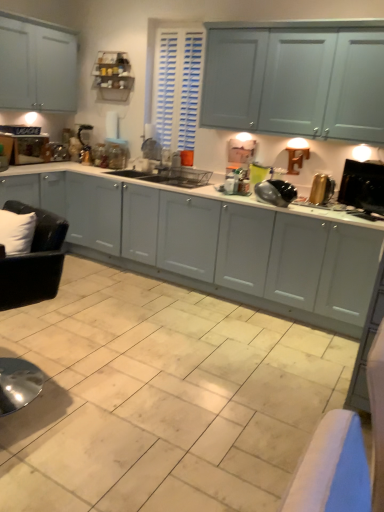
The height and width of the screenshot is (512, 384). Find the location of `beige ceramic tile at center`. beige ceramic tile at center is located at coordinates (161, 398).

Where is `gold metallic toaster at right, acting as the second appliance starting from the left`? The image size is (384, 512). gold metallic toaster at right, acting as the second appliance starting from the left is located at coordinates (321, 189).

From the picture: Measure the distance between gold metallic toaster at right, the second appliance when ordered from right to left, and camera.

The depth of gold metallic toaster at right, the second appliance when ordered from right to left, is 3.18 meters.

What do you see at coordinates (276, 192) in the screenshot? I see `black glossy pan at center, which is counted as the 1th appliance, starting from the left` at bounding box center [276, 192].

What do you see at coordinates (363, 186) in the screenshot? This screenshot has width=384, height=512. I see `black plastic monitor at right, which is counted as the first appliance, starting from the right` at bounding box center [363, 186].

Where is `beige ceramic tile at center`? The height and width of the screenshot is (512, 384). beige ceramic tile at center is located at coordinates (161, 398).

Are matte white cabinets at center and black glossy pan at center, which is counted as the 1th appliance, starting from the left, far apart?

No.

Is matte white cabinets at center closer to camera compared to black glossy pan at center, which is counted as the 1th appliance, starting from the left?

Yes, matte white cabinets at center is closer to the camera.

From a real-world perspective, which object rests below the other?

In real-world perspective, matte white cabinets at center is lower.

Is black plastic monitor at right, which is counted as the first appliance, starting from the right, with matte white cabinets at center?

No.

How different are the orientations of black plastic monitor at right, positioned as the third appliance in left-to-right order, and matte white cabinets at center in degrees?

33.6 degrees.

What are the coordinates of `cabinetry on the left of black plastic monitor at right, positioned as the third appliance in left-to-right order` in the screenshot? It's located at (213, 242).

Is black plastic monitor at right, which is counted as the first appliance, starting from the right, surrounding matte white cabinets at center?

Actually, matte white cabinets at center is outside black plastic monitor at right, which is counted as the first appliance, starting from the right.

From the image's perspective, between gold metallic toaster at right, the second appliance when ordered from right to left, and black glossy pan at center, which is counted as the 1th appliance, starting from the left, which one is located above?

From the image's view, gold metallic toaster at right, the second appliance when ordered from right to left, is above.

Is gold metallic toaster at right, the second appliance when ordered from right to left, bigger than black glossy pan at center, which ranks as the third appliance in right-to-left order?

No.

Image resolution: width=384 pixels, height=512 pixels. Identify the location of the 1st appliance in front of the gold metallic toaster at right, the second appliance when ordered from right to left. (276, 192).

Looking at this image, would you consider black glossy pan at center, which is counted as the 1th appliance, starting from the left, to be distant from black plastic monitor at right, positioned as the third appliance in left-to-right order?

That's not correct — black glossy pan at center, which is counted as the 1th appliance, starting from the left, is a little close to black plastic monitor at right, positioned as the third appliance in left-to-right order.

Does point (287, 203) appear closer or farther from the camera than point (366, 170)?

Point (287, 203).

What's the angular difference between black glossy pan at center, which ranks as the third appliance in right-to-left order, and black plastic monitor at right, which is counted as the first appliance, starting from the right,'s facing directions?

black glossy pan at center, which ranks as the third appliance in right-to-left order, and black plastic monitor at right, which is counted as the first appliance, starting from the right, are facing 34.9 degrees away from each other.

In the image, is black glossy pan at center, which ranks as the third appliance in right-to-left order, on the left side or the right side of black plastic monitor at right, positioned as the third appliance in left-to-right order?

From the image, it's evident that black glossy pan at center, which ranks as the third appliance in right-to-left order, is to the left of black plastic monitor at right, positioned as the third appliance in left-to-right order.

The image size is (384, 512). What are the coordinates of `ceramic tile below the black glossy pan at center, which is counted as the 1th appliance, starting from the left (from the image's perspective)` in the screenshot? It's located at (161, 398).

Is black glossy pan at center, which is counted as the 1th appliance, starting from the left, completely or partially outside of beige ceramic tile at center?

Yes, black glossy pan at center, which is counted as the 1th appliance, starting from the left, is not within beige ceramic tile at center.

Is black glossy pan at center, which ranks as the third appliance in right-to-left order, positioned far away from beige ceramic tile at center?

Yes, black glossy pan at center, which ranks as the third appliance in right-to-left order, and beige ceramic tile at center are quite far apart.

Looking at this image, between black glossy pan at center, which ranks as the third appliance in right-to-left order, and beige ceramic tile at center, which one is positioned behind?

black glossy pan at center, which ranks as the third appliance in right-to-left order, is further from the camera.

From the image's perspective, is black plastic monitor at right, positioned as the third appliance in left-to-right order, above gold metallic toaster at right, acting as the second appliance starting from the left?

Actually, black plastic monitor at right, positioned as the third appliance in left-to-right order, appears below gold metallic toaster at right, acting as the second appliance starting from the left, in the image.

Considering the relative positions of black plastic monitor at right, which is counted as the first appliance, starting from the right, and gold metallic toaster at right, the second appliance when ordered from right to left, in the image provided, is black plastic monitor at right, which is counted as the first appliance, starting from the right, to the left or to the right of gold metallic toaster at right, the second appliance when ordered from right to left,?

In the image, black plastic monitor at right, which is counted as the first appliance, starting from the right, appears on the right side of gold metallic toaster at right, the second appliance when ordered from right to left.

Considering the relative sizes of black plastic monitor at right, which is counted as the first appliance, starting from the right, and gold metallic toaster at right, the second appliance when ordered from right to left, in the image provided, is black plastic monitor at right, which is counted as the first appliance, starting from the right, smaller than gold metallic toaster at right, the second appliance when ordered from right to left,?

Incorrect, black plastic monitor at right, which is counted as the first appliance, starting from the right, is not smaller in size than gold metallic toaster at right, the second appliance when ordered from right to left.

From a real-world perspective, is black glossy pan at center, which is counted as the 1th appliance, starting from the left, physically above matte white cabinets at center?

Yes, from a real-world perspective, black glossy pan at center, which is counted as the 1th appliance, starting from the left, is above matte white cabinets at center.

Considering the positions of objects black glossy pan at center, which ranks as the third appliance in right-to-left order, and matte white cabinets at center in the image provided, who is more to the right, black glossy pan at center, which ranks as the third appliance in right-to-left order, or matte white cabinets at center?

Positioned to the right is black glossy pan at center, which ranks as the third appliance in right-to-left order.

Consider the image. Can you confirm if black glossy pan at center, which is counted as the 1th appliance, starting from the left, is bigger than matte white cabinets at center?

No, black glossy pan at center, which is counted as the 1th appliance, starting from the left, is not bigger than matte white cabinets at center.

Is black glossy pan at center, which ranks as the third appliance in right-to-left order, closer to camera compared to matte white cabinets at center?

No, black glossy pan at center, which ranks as the third appliance in right-to-left order, is further to the viewer.

At what (x,y) coordinates should I click in order to perform the action: click on the 1st appliance counting from the right side of the matte white cabinets at center. Please return your answer as a coordinate pair (x, y). Looking at the image, I should click on (276, 192).

From a real-world perspective, count 3rd appliances upward from the matte white cabinets at center and point to it. Please provide its 2D coordinates.

[(363, 186)]

When comparing their distances from matte white cabinets at center, does black glossy pan at center, which is counted as the 1th appliance, starting from the left, or black plastic monitor at right, positioned as the third appliance in left-to-right order, seem closer?

Based on the image, black glossy pan at center, which is counted as the 1th appliance, starting from the left, appears to be nearer to matte white cabinets at center.

Which object lies nearer to the anchor point gold metallic toaster at right, acting as the second appliance starting from the left, beige ceramic tile at center or black glossy pan at center, which is counted as the 1th appliance, starting from the left?

The object closer to gold metallic toaster at right, acting as the second appliance starting from the left, is black glossy pan at center, which is counted as the 1th appliance, starting from the left.

Considering their positions, is matte white cabinets at center positioned further to black plastic monitor at right, which is counted as the first appliance, starting from the right, than beige ceramic tile at center?

Among the two, beige ceramic tile at center is located further to black plastic monitor at right, which is counted as the first appliance, starting from the right.

From the image, which object appears to be nearer to matte white cabinets at center, beige ceramic tile at center or gold metallic toaster at right, the second appliance when ordered from right to left?

beige ceramic tile at center is closer to matte white cabinets at center.

From the image, which object appears to be nearer to black plastic monitor at right, which is counted as the first appliance, starting from the right, black glossy pan at center, which is counted as the 1th appliance, starting from the left, or beige ceramic tile at center?

black glossy pan at center, which is counted as the 1th appliance, starting from the left.

Looking at the image, which one is located closer to matte white cabinets at center, black plastic monitor at right, positioned as the third appliance in left-to-right order, or beige ceramic tile at center?

Based on the image, beige ceramic tile at center appears to be nearer to matte white cabinets at center.

When comparing their distances from gold metallic toaster at right, the second appliance when ordered from right to left, does matte white cabinets at center or beige ceramic tile at center seem closer?

Among the two, matte white cabinets at center is located nearer to gold metallic toaster at right, the second appliance when ordered from right to left.

From the image, which object appears to be nearer to matte white cabinets at center, gold metallic toaster at right, acting as the second appliance starting from the left, or black glossy pan at center, which is counted as the 1th appliance, starting from the left?

black glossy pan at center, which is counted as the 1th appliance, starting from the left, is positioned closer to the anchor matte white cabinets at center.

You are a GUI agent. You are given a task and a screenshot of the screen. Output one action in this format:
    pyautogui.click(x=<x>, y=<y>)
    Task: Click on the cabinetry between beige ceramic tile at center and black plastic monitor at right, which is counted as the first appliance, starting from the right, in the horizontal direction
    
    Given the screenshot: What is the action you would take?
    (x=213, y=242)

What are the coordinates of `appliance between matte white cabinets at center and gold metallic toaster at right, the second appliance when ordered from right to left, in the horizontal direction` in the screenshot? It's located at [276, 192].

This screenshot has width=384, height=512. Find the location of `appliance located between beige ceramic tile at center and black glossy pan at center, which is counted as the 1th appliance, starting from the left, in the depth direction`. appliance located between beige ceramic tile at center and black glossy pan at center, which is counted as the 1th appliance, starting from the left, in the depth direction is located at coordinates (363, 186).

You are a GUI agent. You are given a task and a screenshot of the screen. Output one action in this format:
    pyautogui.click(x=<x>, y=<y>)
    Task: Click on the cabinetry between beige ceramic tile at center and gold metallic toaster at right, the second appliance when ordered from right to left, from front to back
    This screenshot has width=384, height=512.
    Given the screenshot: What is the action you would take?
    click(213, 242)